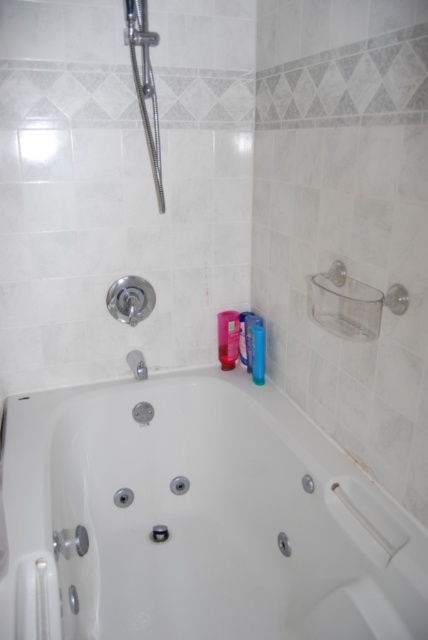
You are standing in the bathroom and need to place a small plant between the two points marked as point (x=217, y=317) and point (x=261, y=352). Since the plant is only 10 cm tall, will it be visible from the shower caddy on the right side of the tub?

The point (x=217, y=317) is closer to the viewer than point (x=261, y=352), so placing the plant between them would mean it is positioned at a closer distance. Since the shower caddy is on the right side of the tub, the plant should be visible from there as it is within the line of sight.

From the picture: You are standing in the bathroom and want to reach the polished chrome showerhead at upper left. The shower caddy is on the right side of the tub. Can you estimate if you can reach it without moving your feet?

The distance between you and the polished chrome showerhead at upper left is 5.18 feet. Since this distance is greater than the typical human arm length of about 2.5 feet, you cannot reach it without moving your feet.

You are a bathroom assistant and need to place a new pink plastic bottle and a pink matte bottle on the shower caddy. The shower caddy has a height limit of 15 cm. Given that the pink plastic bottle at upper right is taller than the pink matte bottle at upper right, which bottle should you choose to ensure it fits within the height restriction?

The pink matte bottle at upper right should be chosen because it has a shorter height compared to the pink plastic bottle at upper right, ensuring it fits within the 15 cm height limit of the shower caddy.